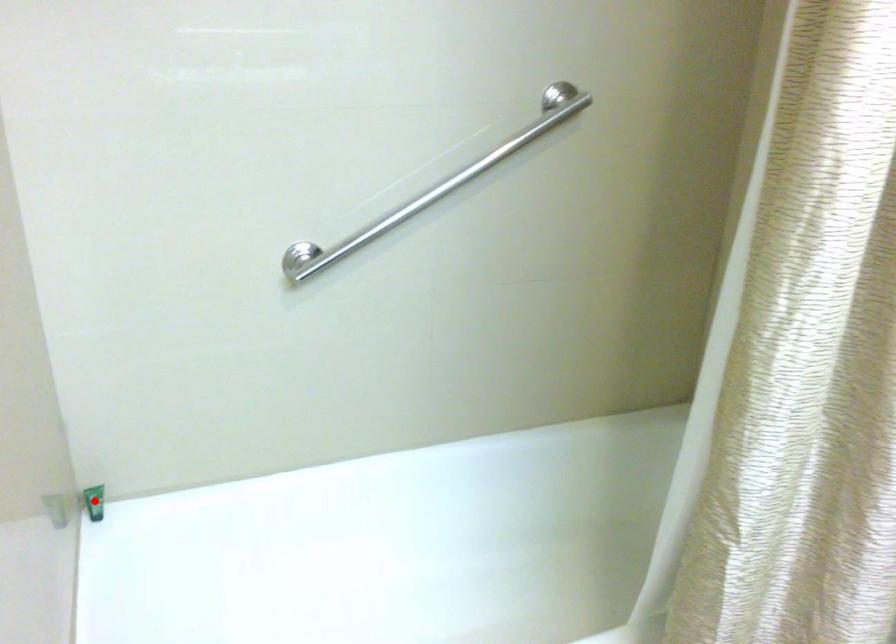
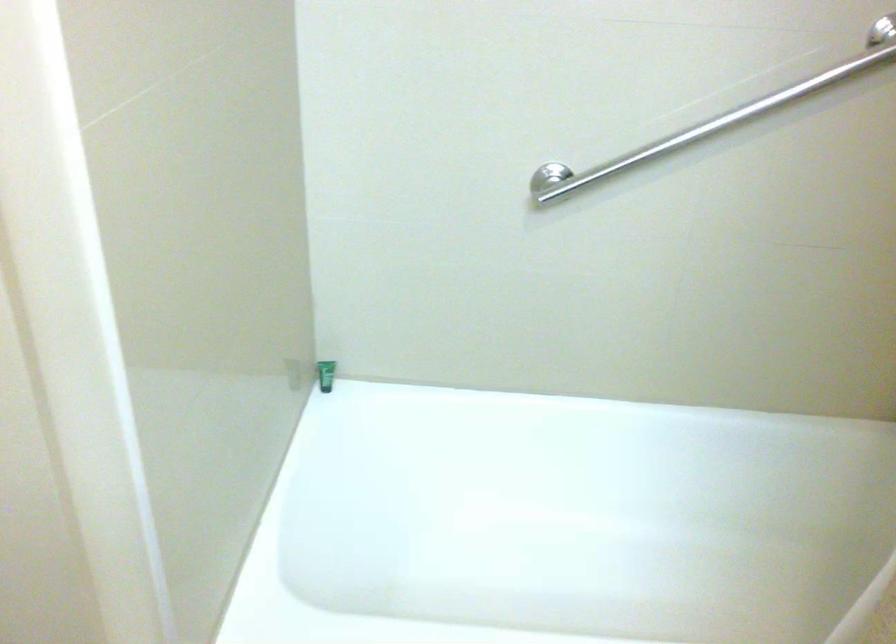
Find the pixel in the second image that matches the highlighted location in the first image.

(325, 375)